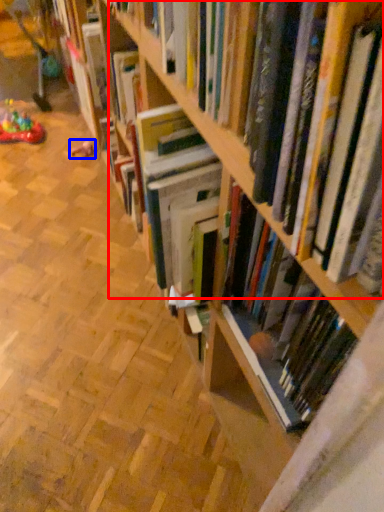
Question: Among these objects, which one is farthest to the camera, book (highlighted by a red box) or toy (highlighted by a blue box)?

Choices:
 (A) book
 (B) toy

Answer: (B)